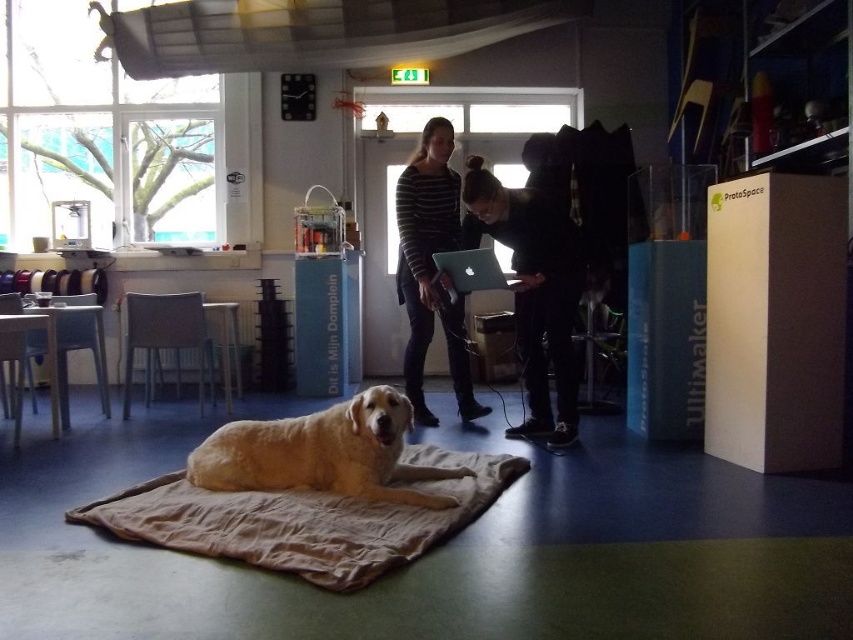
You are organizing a workshop in the maker space and need to place a 3D printer on the floor. The 3D printer requires a clear space of at least 1 meter in front of it. Given the objects present, can you place the 3D printer in front of the black fabric jacket at center and the silver metallic laptop at center?

The black fabric jacket at center is taller than the silver metallic laptop at center. However, the spatial description does not provide information about the distance between these objects. Therefore, it is unclear if there is sufficient space to place the 3D printer. You should check the actual distance between the objects to ensure there is at least 1 meter of clear space.